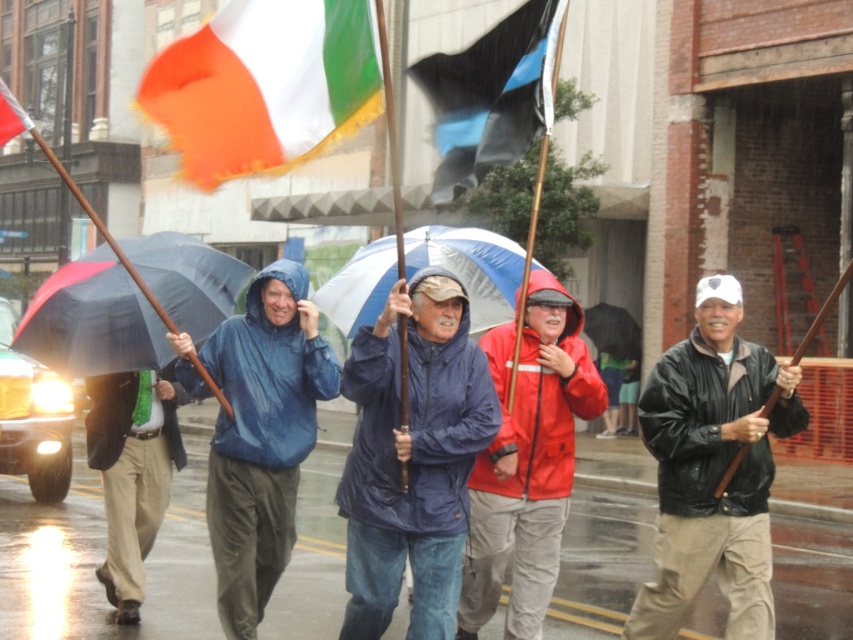
Question: Can you confirm if black leather jacket at center is smaller than black matte flag at center?

Choices:
 (A) yes
 (B) no

Answer: (B)

Question: Does black matte flag at center have a greater width compared to white and green fabric flag at upper left?

Choices:
 (A) yes
 (B) no

Answer: (B)

Question: Which point appears closest to the camera in this image?

Choices:
 (A) (0, 109)
 (B) (537, 392)

Answer: (A)

Question: Among these objects, which one is farthest from the camera?

Choices:
 (A) black matte umbrella at left
 (B) khaki cotton pants at center
 (C) blue matte jacket at center

Answer: (B)

Question: Which point is farther from the camera taking this photo?

Choices:
 (A) (347, 483)
 (B) (434, 198)
 (C) (602, 340)
 (D) (474, 304)

Answer: (C)

Question: Can you confirm if orange fabric flag at upper left is positioned to the left of matte blue raincoat at center?

Choices:
 (A) no
 (B) yes

Answer: (B)